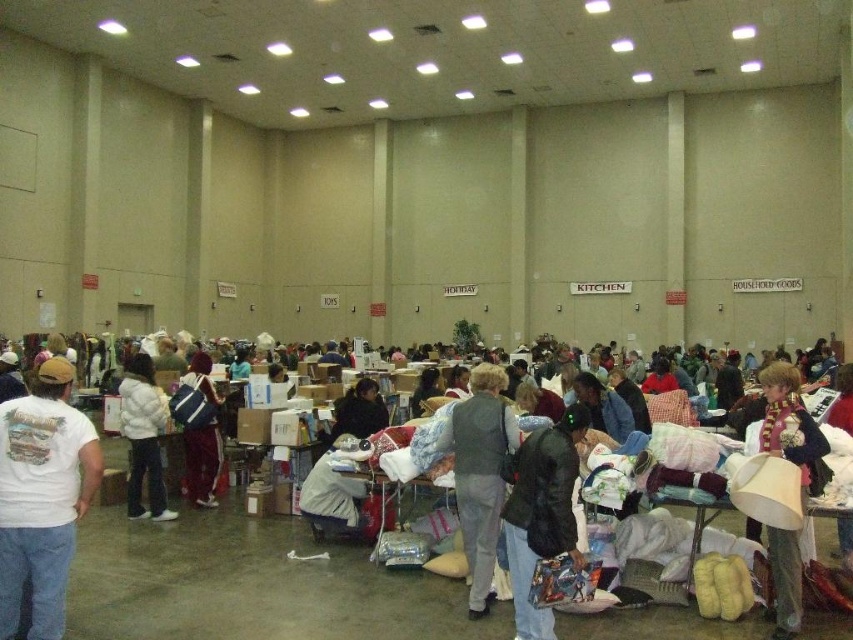
Question: Which object appears farthest from the camera in this image?

Choices:
 (A) dark gray sweater at center
 (B) white cotton t-shirt at left
 (C) velvet blue backpack at center

Answer: (C)

Question: Which point is farther from the camera taking this photo?

Choices:
 (A) (345, 417)
 (B) (488, 589)

Answer: (A)

Question: Considering the relative positions of dark gray jacket at center and velvet blue backpack at center in the image provided, where is dark gray jacket at center located with respect to velvet blue backpack at center?

Choices:
 (A) right
 (B) left

Answer: (A)

Question: Observing the image, what is the correct spatial positioning of dark gray jacket at center in reference to velvet maroon scarf at lower right?

Choices:
 (A) left
 (B) right

Answer: (A)

Question: Which point appears closest to the camera in this image?

Choices:
 (A) (374, 426)
 (B) (131, 436)

Answer: (B)

Question: Is dark gray jacket at center thinner than dark gray sweater at center?

Choices:
 (A) yes
 (B) no

Answer: (A)